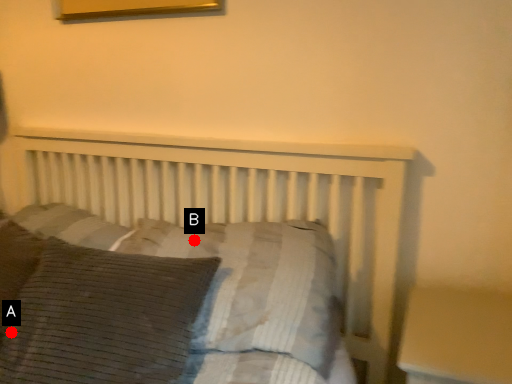
Question: Two points are circled on the image, labeled by A and B beside each circle. Which point appears closest to the camera in this image?

Choices:
 (A) A is closer
 (B) B is closer

Answer: (A)